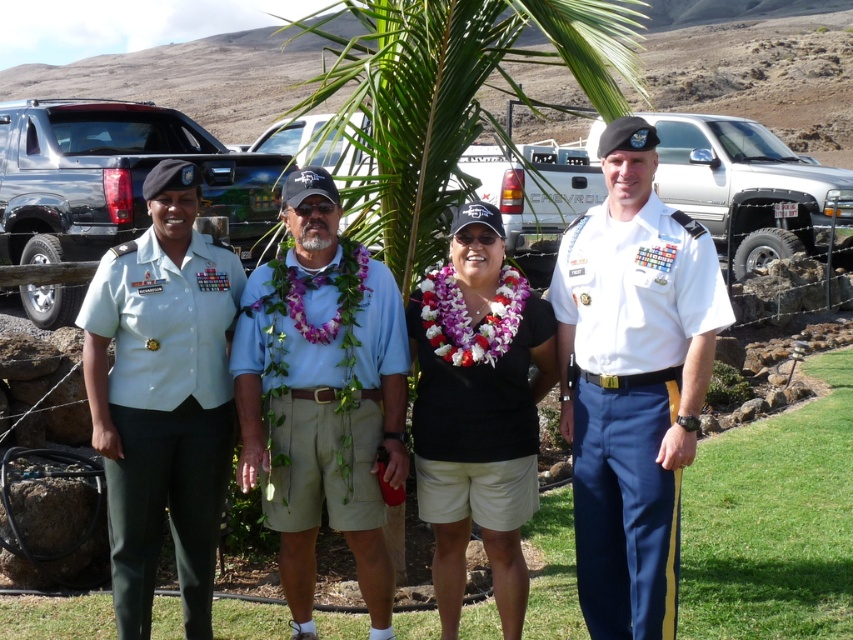
You are standing at the point marked by the coordinates point (590, 541). You want to greet someone who is 5 meters away from you. Can you reach them by walking straight ahead?

Yes, because the distance between you and the viewer is exactly 4.91 meters, which is just under 5 meters. Walking straight ahead should allow you to reach them.